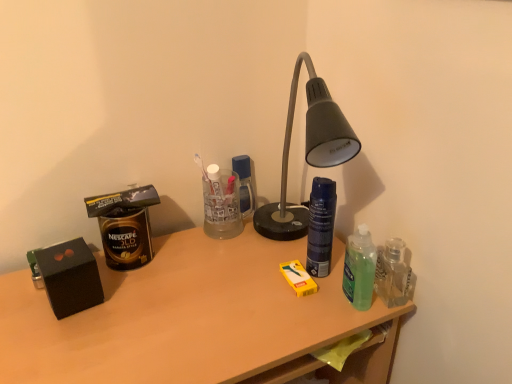
The width and height of the screenshot is (512, 384). What do you see at coordinates (321, 226) in the screenshot? I see `shiny dark blue spray can at center-right` at bounding box center [321, 226].

Find the location of `shiny dark blue spray can at center-right`. shiny dark blue spray can at center-right is located at coordinates point(321,226).

Identify the location of matte black box at left. (190, 319).

The width and height of the screenshot is (512, 384). What do you see at coordinates (190, 319) in the screenshot?
I see `matte black box at left` at bounding box center [190, 319].

Image resolution: width=512 pixels, height=384 pixels. Identify the location of shiny dark blue spray can at center-right. (321, 226).

Which is more to the left, shiny dark blue spray can at center-right or matte black box at left?

Positioned to the left is matte black box at left.

Considering the relative positions of shiny dark blue spray can at center-right and matte black box at left in the image provided, is shiny dark blue spray can at center-right in front of matte black box at left?

No, shiny dark blue spray can at center-right is behind matte black box at left.

Considering the positions of points (327, 221) and (12, 316), is point (327, 221) farther from camera compared to point (12, 316)?

Yes.

From the image's perspective, would you say shiny dark blue spray can at center-right is shown under matte black box at left?

No.

From a real-world perspective, which is physically above, shiny dark blue spray can at center-right or matte black box at left?

In real-world perspective, shiny dark blue spray can at center-right is above.

Is shiny dark blue spray can at center-right wider or thinner than matte black box at left?

Clearly, shiny dark blue spray can at center-right has less width compared to matte black box at left.

Which of these two, shiny dark blue spray can at center-right or matte black box at left, stands shorter?

shiny dark blue spray can at center-right.

In terms of size, does shiny dark blue spray can at center-right appear bigger or smaller than matte black box at left?

Clearly, shiny dark blue spray can at center-right is smaller in size than matte black box at left.

Is shiny dark blue spray can at center-right situated inside matte black box at left or outside?

shiny dark blue spray can at center-right is not enclosed by matte black box at left.

Is shiny dark blue spray can at center-right positioned far away from matte black box at left?

No, there isn't a large distance between shiny dark blue spray can at center-right and matte black box at left.

Does shiny dark blue spray can at center-right turn towards matte black box at left?

No, shiny dark blue spray can at center-right is not turned towards matte black box at left.

How many degrees apart are the facing directions of shiny dark blue spray can at center-right and matte black box at left?

11.3 degrees.

What are the coordinates of `desk located in front of the shiny dark blue spray can at center-right` in the screenshot? It's located at (190, 319).

Which object is positioned more to the left, matte black box at left or shiny dark blue spray can at center-right?

matte black box at left is more to the left.

In the scene shown: Does matte black box at left come in front of shiny dark blue spray can at center-right?

Yes, matte black box at left is closer to the camera.

Which is closer, (182,348) or (310,234)?

Point (182,348) is positioned closer to the camera compared to point (310,234).

From the image's perspective, is matte black box at left located above or below shiny dark blue spray can at center-right?

matte black box at left is situated lower than shiny dark blue spray can at center-right in the image.

From a real-world perspective, is matte black box at left on top of shiny dark blue spray can at center-right?

Incorrect, from a real-world perspective, matte black box at left is lower than shiny dark blue spray can at center-right.

Is matte black box at left wider or thinner than shiny dark blue spray can at center-right?

Clearly, matte black box at left has more width compared to shiny dark blue spray can at center-right.

Can you confirm if matte black box at left is taller than shiny dark blue spray can at center-right?

Yes, matte black box at left is taller than shiny dark blue spray can at center-right.

Is matte black box at left smaller than shiny dark blue spray can at center-right?

No.

Is matte black box at left not within shiny dark blue spray can at center-right?

matte black box at left lies outside shiny dark blue spray can at center-right's area.

Is matte black box at left placed right next to shiny dark blue spray can at center-right?

There is a gap between matte black box at left and shiny dark blue spray can at center-right.

From the picture: Could you tell me if matte black box at left is turned towards shiny dark blue spray can at center-right?

No, matte black box at left is not turned towards shiny dark blue spray can at center-right.

How far apart are matte black box at left and shiny dark blue spray can at center-right?

The distance of matte black box at left from shiny dark blue spray can at center-right is 24.24 centimeters.

In the image, there is a shiny dark blue spray can at center-right. At what (x,y) coordinates should I click in order to perform the action: click on desk below it (from a real-world perspective). Please return your answer as a coordinate pair (x, y). Looking at the image, I should click on (190, 319).

Image resolution: width=512 pixels, height=384 pixels. I want to click on bottle above the matte black box at left (from a real-world perspective), so click(x=321, y=226).

The height and width of the screenshot is (384, 512). What are the coordinates of `desk lying in front of the shiny dark blue spray can at center-right` in the screenshot? It's located at pyautogui.click(x=190, y=319).